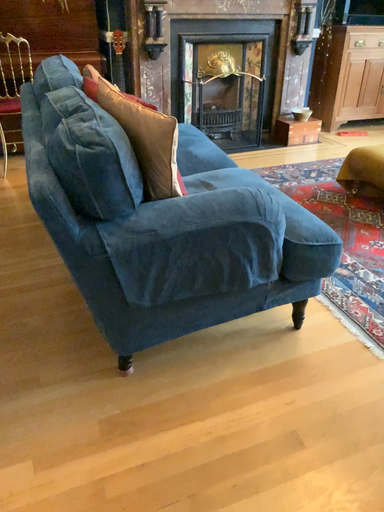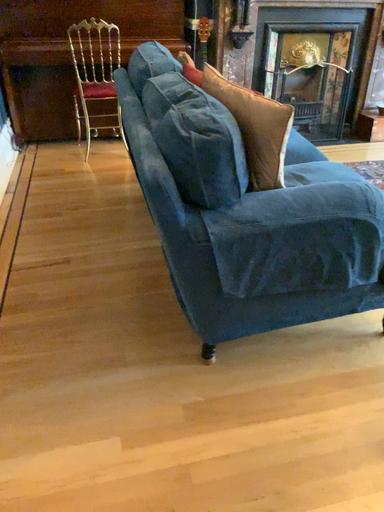
Question: How did the camera likely rotate when shooting the video?

Choices:
 (A) rotated left
 (B) rotated right

Answer: (A)